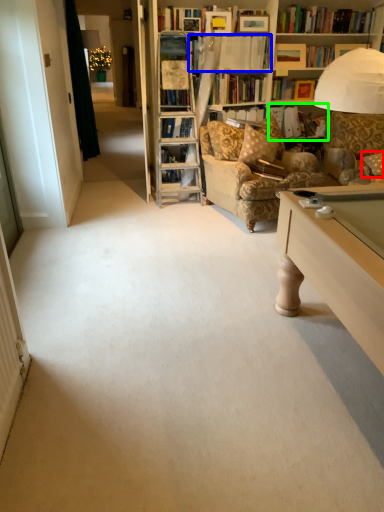
Question: Which object is the closest to the pillow (highlighted by a red box)? Choose among these: book (highlighted by a blue box) or book (highlighted by a green box).

Choices:
 (A) book
 (B) book

Answer: (B)